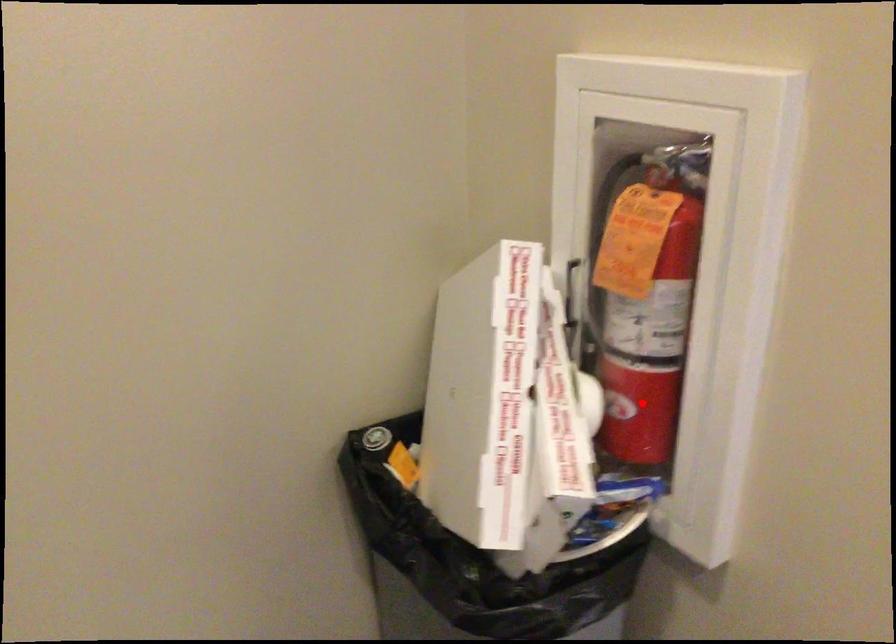
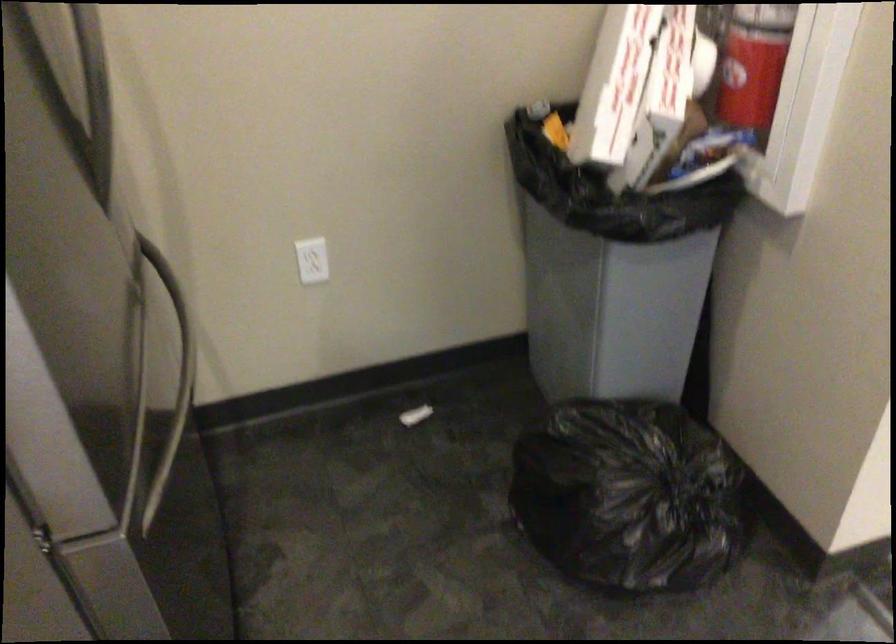
Question: I am providing you with two images of the same scene from different viewpoints. Image1 has a red point marked. In image2, the corresponding 3D location appears at what relative position? Reply with the corresponding letter.

Choices:
 (A) Closer
 (B) Farther

Answer: (B)